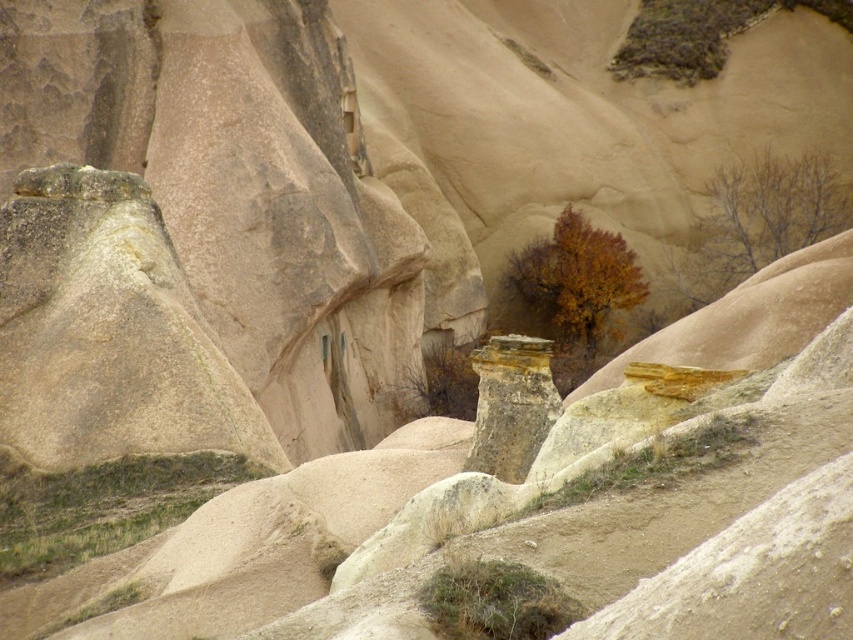
Question: Is brown leafy tree at upper right smaller than brown matte tree at center?

Choices:
 (A) yes
 (B) no

Answer: (B)

Question: Can you confirm if brown leafy tree at upper right is positioned above brown matte tree at center?

Choices:
 (A) no
 (B) yes

Answer: (B)

Question: Which of the following is the closest to the observer?

Choices:
 (A) (512, 262)
 (B) (740, 216)

Answer: (A)

Question: Does brown leafy tree at upper right have a larger size compared to brown matte tree at center?

Choices:
 (A) no
 (B) yes

Answer: (B)

Question: Which point appears closest to the camera in this image?

Choices:
 (A) (547, 259)
 (B) (770, 180)

Answer: (A)

Question: Which point is farther from the camera taking this photo?

Choices:
 (A) (595, 285)
 (B) (846, 212)

Answer: (B)